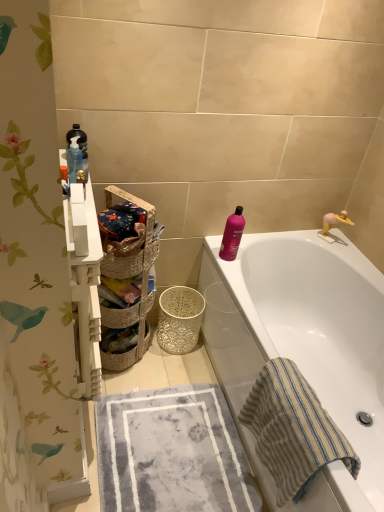
This screenshot has height=512, width=384. I want to click on free space on the front side of woven beige basket at left, so click(128, 386).